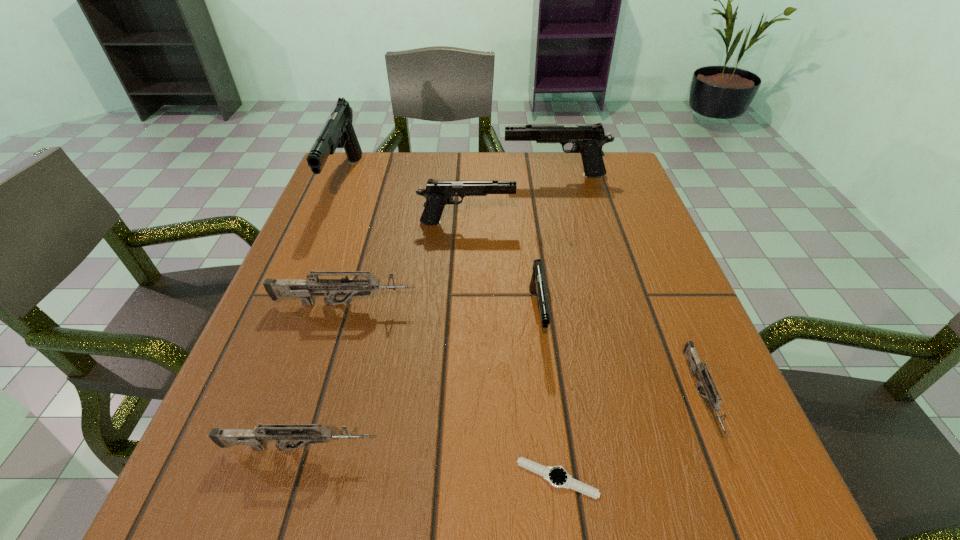
Locate an element on the screen. Image resolution: width=960 pixels, height=540 pixels. vacant area at the right edge of the desktop is located at coordinates (738, 429).

Find the location of a particular element. This screenshot has height=540, width=960. blank space at the far left corner is located at coordinates (387, 157).

Where is `free space at the near right corner`? The image size is (960, 540). free space at the near right corner is located at coordinates 698,460.

Find the location of `blank region between the second shortest gun and the second tallest gun`. blank region between the second shortest gun and the second tallest gun is located at coordinates (427, 312).

You are a GUI agent. You are given a task and a screenshot of the screen. Output one action in this format:
    pyautogui.click(x=<x>, y=<y>)
    Task: Click on the empty location between the nearest black gun and the sixth shortest object
    The width and height of the screenshot is (960, 540).
    Given the screenshot: What is the action you would take?
    pyautogui.click(x=502, y=269)

Image resolution: width=960 pixels, height=540 pixels. What are the coordinates of `vacant region between the nearest black gun and the third smallest black gun` in the screenshot? It's located at (546, 245).

The width and height of the screenshot is (960, 540). I want to click on vacant area that lies between the shortest object and the third biggest black gun, so click(x=512, y=350).

The width and height of the screenshot is (960, 540). Identify the location of unoccupied area between the leftmost black gun and the farthest grey gun. (346, 243).

The height and width of the screenshot is (540, 960). I want to click on unoccupied position between the biggest grey gun and the nearest black gun, so click(442, 309).

In order to click on vacant space in between the fifth shortest gun and the smallest black gun in this screenshot , I will do `click(502, 269)`.